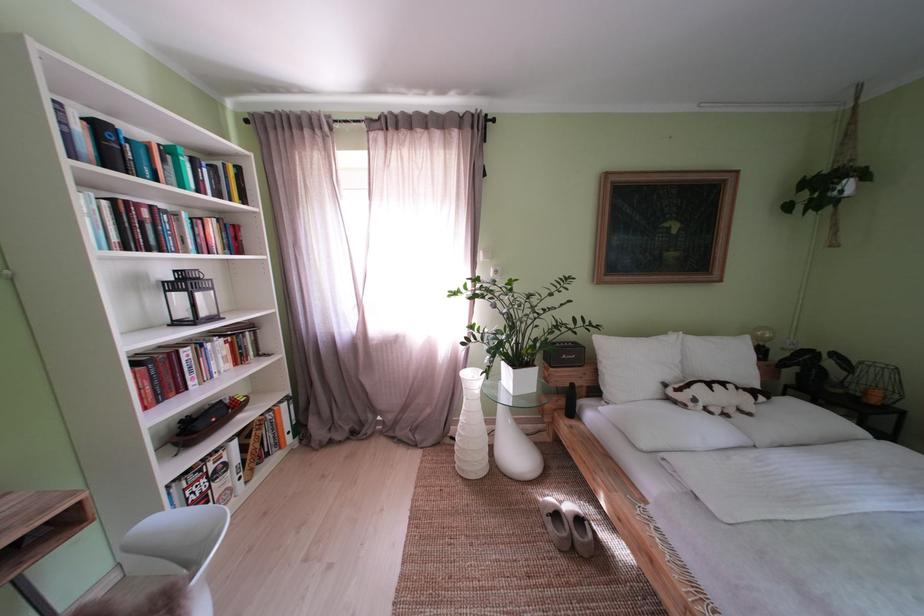
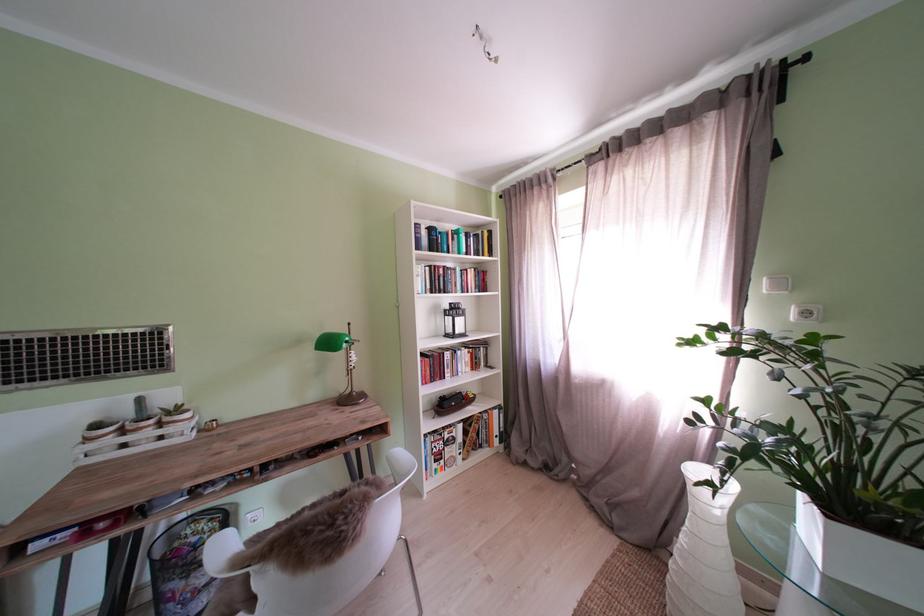
Find the pixel in the second image that matches [192,394] in the first image.

(454, 382)